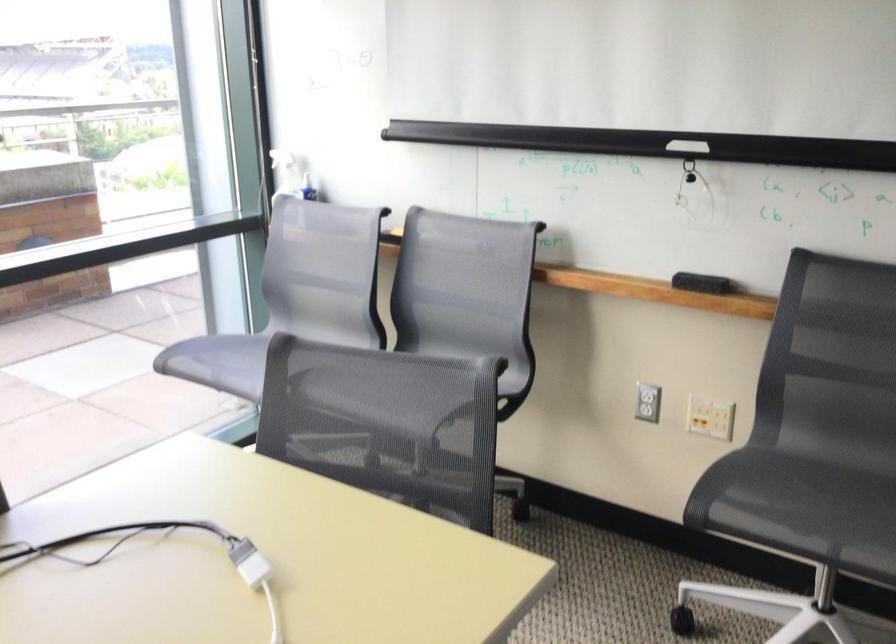
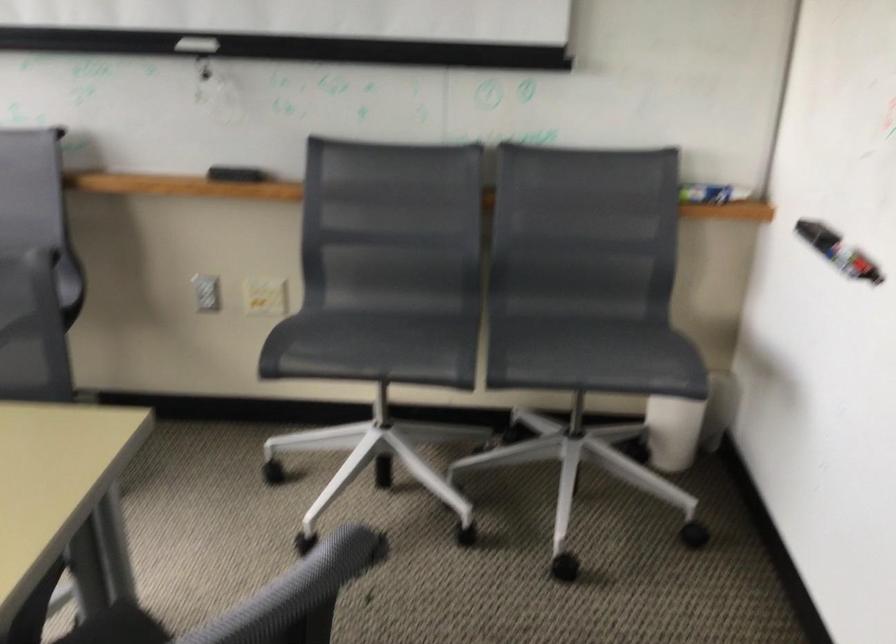
Question: The camera is either moving clockwise (left) or counter-clockwise (right) around the object. The first image is from the beginning of the video and the second image is from the end. Is the camera moving left or right when shooting the video?

Choices:
 (A) Left
 (B) Right

Answer: (A)